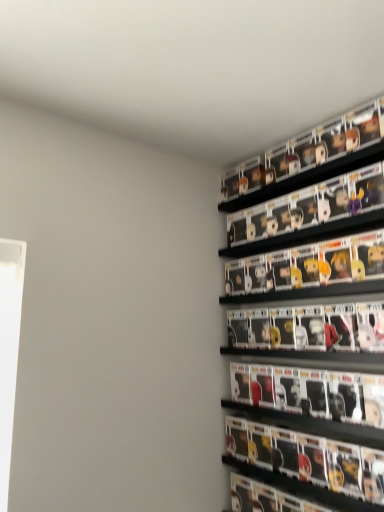
Question: Can you confirm if matte black figure at right is wider than black plastic shelf at upper right, positioned as the first shelf in top-to-bottom order?

Choices:
 (A) yes
 (B) no

Answer: (A)

Question: Considering the relative sizes of matte black figure at right and black plastic shelf at upper right, positioned as the first shelf in top-to-bottom order, in the image provided, is matte black figure at right smaller than black plastic shelf at upper right, positioned as the first shelf in top-to-bottom order,?

Choices:
 (A) yes
 (B) no

Answer: (B)

Question: From a real-world perspective, is matte black figure at right on top of black plastic shelf at upper right, positioned as the 2th shelf in bottom-to-top order?

Choices:
 (A) no
 (B) yes

Answer: (A)

Question: Is matte black figure at right oriented towards black plastic shelf at upper right, positioned as the first shelf in top-to-bottom order?

Choices:
 (A) yes
 (B) no

Answer: (B)

Question: Does matte black figure at right have a lesser width compared to black plastic shelf at upper right, positioned as the first shelf in top-to-bottom order?

Choices:
 (A) no
 (B) yes

Answer: (A)

Question: Is matte black figure at right oriented away from black plastic shelf at upper right, positioned as the 2th shelf in bottom-to-top order?

Choices:
 (A) no
 (B) yes

Answer: (A)

Question: From the image's perspective, would you say matt black figurines at upper right, positioned as the second shelf in top-to-bottom order, is positioned over black plastic shelf at upper right, positioned as the first shelf in top-to-bottom order?

Choices:
 (A) no
 (B) yes

Answer: (A)

Question: Does matt black figurines at upper right, the first shelf in the bottom-to-top sequence, have a greater width compared to black plastic shelf at upper right, positioned as the 2th shelf in bottom-to-top order?

Choices:
 (A) no
 (B) yes

Answer: (B)

Question: Is matt black figurines at upper right, positioned as the second shelf in top-to-bottom order, smaller than black plastic shelf at upper right, positioned as the first shelf in top-to-bottom order?

Choices:
 (A) yes
 (B) no

Answer: (A)

Question: Is matt black figurines at upper right, the first shelf in the bottom-to-top sequence, at the left side of black plastic shelf at upper right, positioned as the first shelf in top-to-bottom order?

Choices:
 (A) no
 (B) yes

Answer: (B)

Question: Does matt black figurines at upper right, the first shelf in the bottom-to-top sequence, appear on the right side of black plastic shelf at upper right, positioned as the 2th shelf in bottom-to-top order?

Choices:
 (A) no
 (B) yes

Answer: (A)

Question: Is matt black figurines at upper right, positioned as the second shelf in top-to-bottom order, with black plastic shelf at upper right, positioned as the first shelf in top-to-bottom order?

Choices:
 (A) no
 (B) yes

Answer: (A)

Question: Is the depth of matt black figurines at upper right, the first shelf in the bottom-to-top sequence, greater than that of matte black figure at right?

Choices:
 (A) yes
 (B) no

Answer: (A)